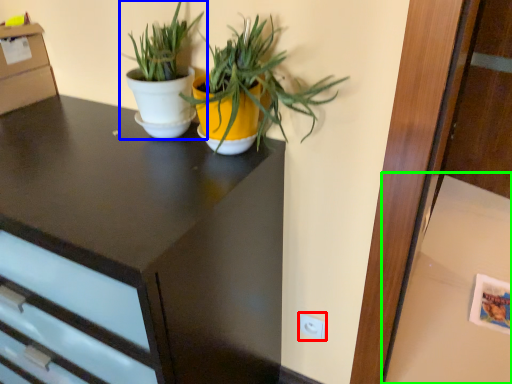
Question: Based on their relative distances, which object is farther from electric outlet (highlighted by a red box)? Choose from houseplant (highlighted by a blue box) and table (highlighted by a green box).

Choices:
 (A) houseplant
 (B) table

Answer: (B)